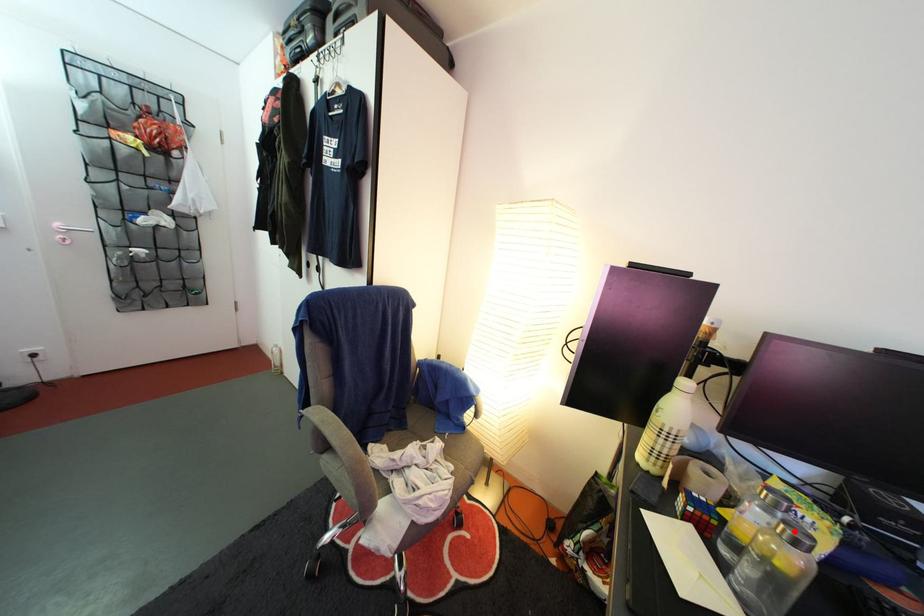
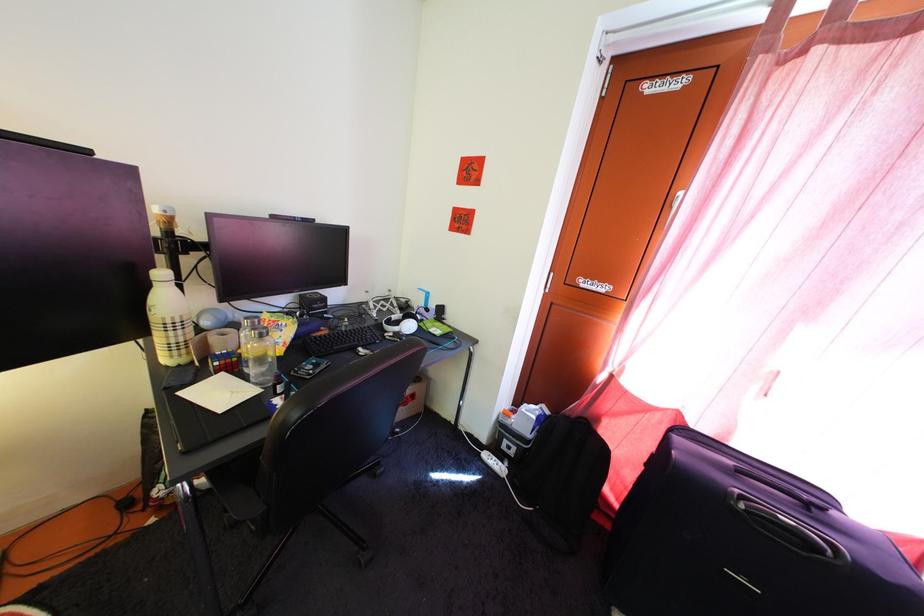
In the second image, find the point that corresponds to the highlighted location in the first image.

(262, 338)